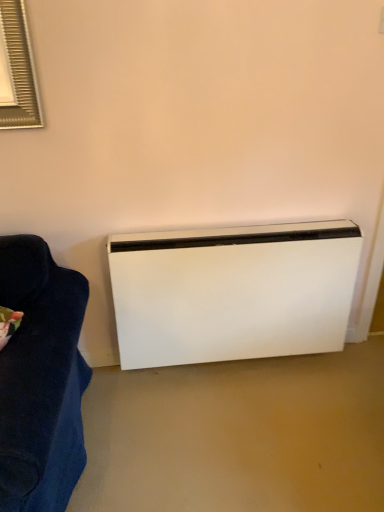
Question: Would you say white matte heater at lower right is inside or outside dark blue fabric couch at left?

Choices:
 (A) outside
 (B) inside

Answer: (A)

Question: Is point (344, 321) closer or farther from the camera than point (31, 340)?

Choices:
 (A) farther
 (B) closer

Answer: (A)

Question: Considering the relative positions of white matte heater at lower right and dark blue fabric couch at left in the image provided, is white matte heater at lower right to the left or to the right of dark blue fabric couch at left?

Choices:
 (A) right
 (B) left

Answer: (A)

Question: From a real-world perspective, relative to white matte heater at lower right, is dark blue fabric couch at left vertically above or below?

Choices:
 (A) below
 (B) above

Answer: (B)

Question: Considering the positions of dark blue fabric couch at left and white matte heater at lower right in the image, is dark blue fabric couch at left bigger or smaller than white matte heater at lower right?

Choices:
 (A) small
 (B) big

Answer: (A)

Question: Is dark blue fabric couch at left to the left or to the right of white matte heater at lower right in the image?

Choices:
 (A) right
 (B) left

Answer: (B)

Question: In terms of height, does dark blue fabric couch at left look taller or shorter compared to white matte heater at lower right?

Choices:
 (A) tall
 (B) short

Answer: (B)